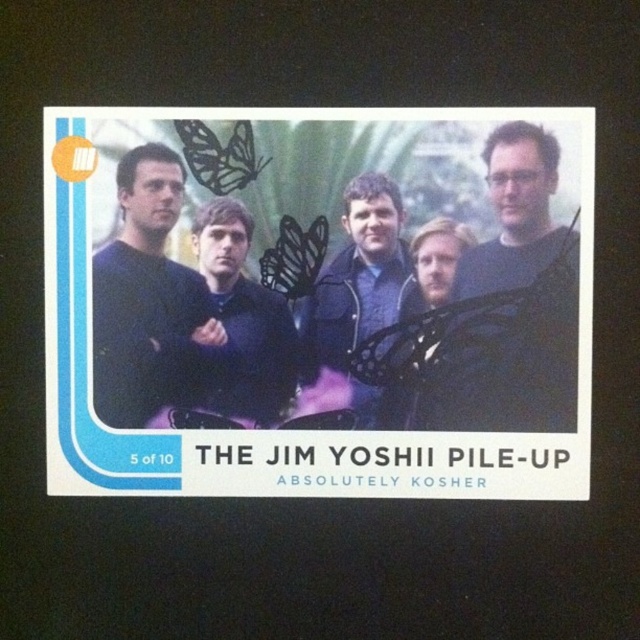
Question: Is the position of matte black group at center less distant than that of dark blue shirt at right?

Choices:
 (A) yes
 (B) no

Answer: (A)

Question: Is matte black group at center wider than black matte butterfly at center?

Choices:
 (A) yes
 (B) no

Answer: (A)

Question: Which point is farther to the camera?

Choices:
 (A) (244, 124)
 (B) (93, 236)
 (C) (564, 333)

Answer: (B)

Question: Is matte black group at center closer to the viewer compared to matte black jacket at center?

Choices:
 (A) yes
 (B) no

Answer: (A)

Question: Which object is farther from the camera taking this photo?

Choices:
 (A) black matte butterfly at upper left
 (B) matte black sweater at left
 (C) matte black jacket at center

Answer: (C)

Question: Which point is closer to the camera taking this photo?

Choices:
 (A) (552, 339)
 (B) (432, 275)
 (C) (120, 380)
 (D) (369, 227)

Answer: (A)